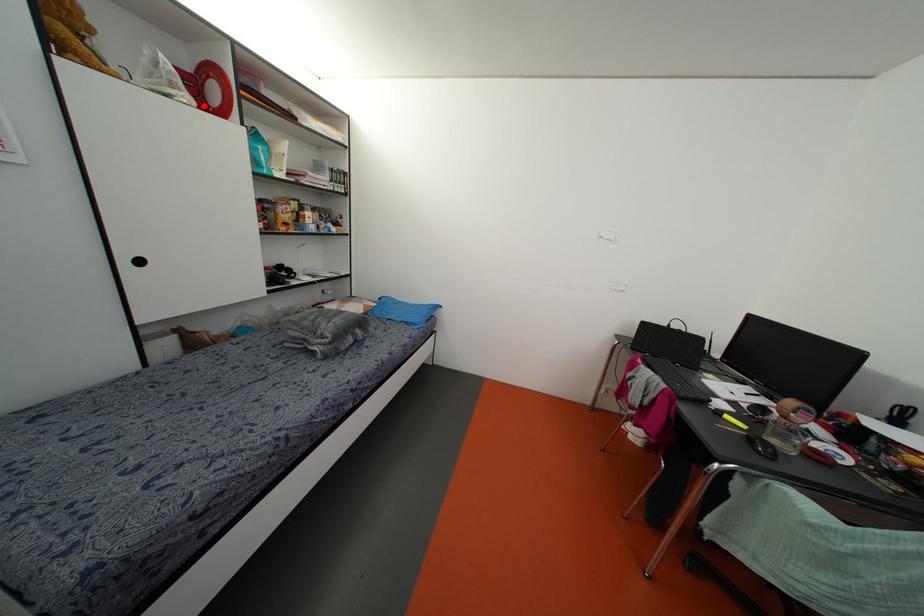
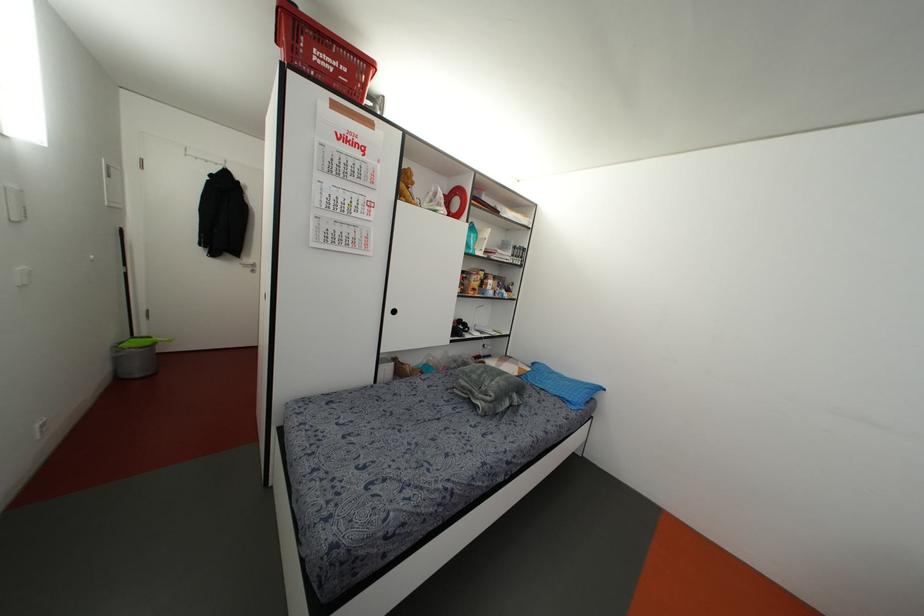
The point at the highlighted location is marked in the first image. Where is the corresponding point in the second image?

(448, 213)